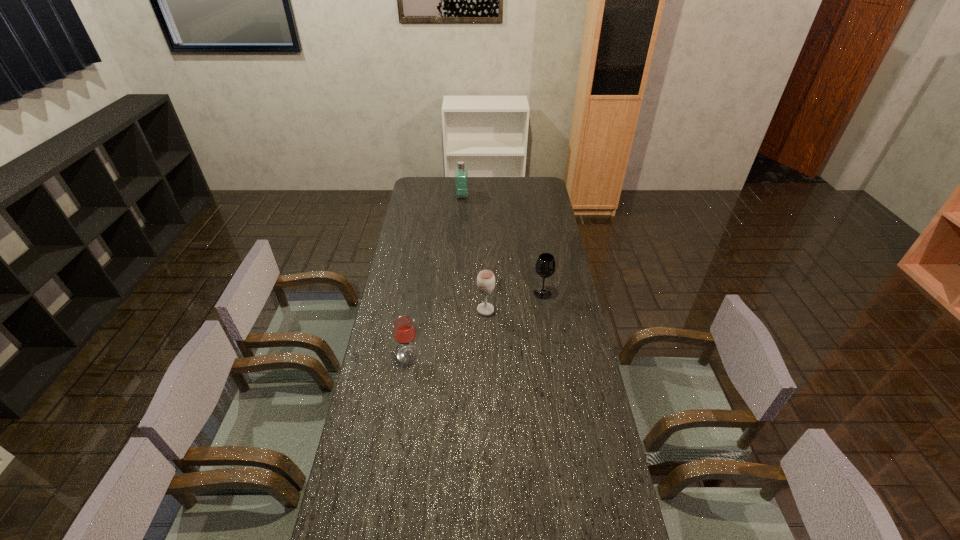
This screenshot has height=540, width=960. I want to click on free space between the farthest wineglass and the third object from left to right, so click(514, 301).

This screenshot has width=960, height=540. In order to click on vacant space in between the leftmost object and the third nearest object in this screenshot , I will do (x=475, y=324).

The height and width of the screenshot is (540, 960). I want to click on free space between the farthest object and the second nearest wineglass, so click(x=474, y=253).

Find the location of a particular element. This screenshot has height=540, width=960. vacant space that's between the rightmost object and the second farthest wineglass is located at coordinates (514, 301).

In order to click on unoccupied position between the perfume and the nearest object in this screenshot , I will do `click(436, 275)`.

I want to click on unoccupied area between the perfume and the nearest object, so click(436, 275).

At what (x,y) coordinates should I click in order to perform the action: click on unoccupied area between the nearest wineglass and the perfume. Please return your answer as a coordinate pair (x, y). Looking at the image, I should click on (436, 275).

At what (x,y) coordinates should I click in order to perform the action: click on vacant region between the second farthest wineglass and the farthest wineglass. Please return your answer as a coordinate pair (x, y). This screenshot has width=960, height=540. Looking at the image, I should click on (514, 301).

Locate an element on the screen. vacant area between the second object from left to right and the third nearest object is located at coordinates (502, 245).

This screenshot has width=960, height=540. Identify the location of object that can be found as the third closest to the perfume. (404, 329).